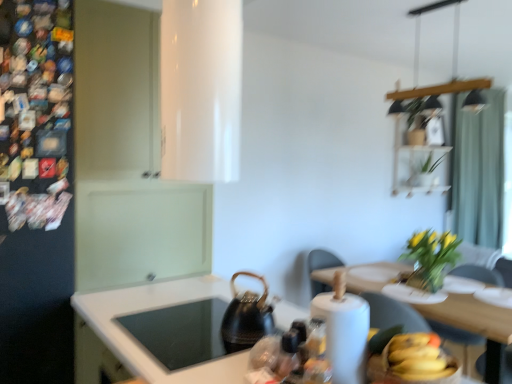
The height and width of the screenshot is (384, 512). I want to click on vacant space positioned to the left of black textured kettle at center, so click(x=197, y=325).